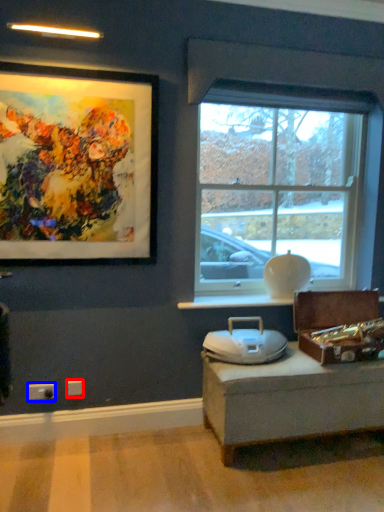
Question: Which object is further to the camera taking this photo, electric outlet (highlighted by a red box) or electric outlet (highlighted by a blue box)?

Choices:
 (A) electric outlet
 (B) electric outlet

Answer: (A)